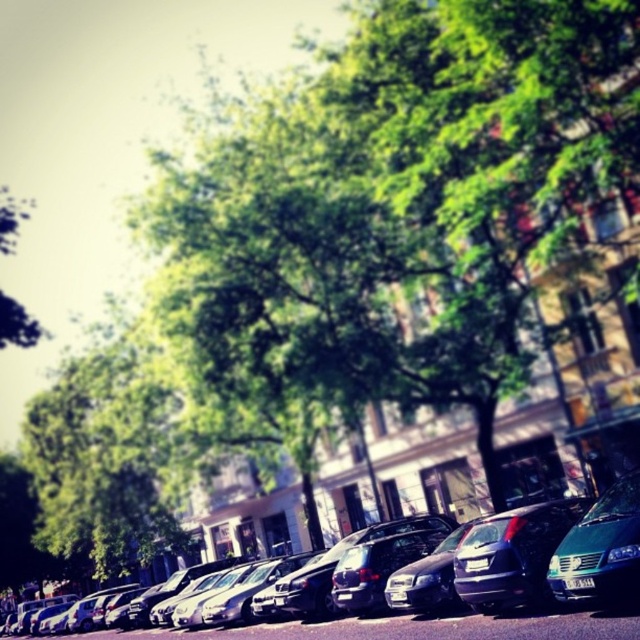
Question: Observing the image, what is the correct spatial positioning of shiny metallic sedan at center in reference to teal matte van at lower right?

Choices:
 (A) left
 (B) right

Answer: (A)

Question: Is green leafy tree at center to the right of teal matte van at lower right from the viewer's perspective?

Choices:
 (A) yes
 (B) no

Answer: (B)

Question: Which of the following is the closest to the observer?

Choices:
 (A) shiny metallic sedan at center
 (B) green leafy tree at center
 (C) teal matte van at lower right

Answer: (A)

Question: Which object is positioned closest to the green leafy tree at center?

Choices:
 (A) shiny metallic sedan at center
 (B) teal matte van at lower right

Answer: (A)

Question: Does green leafy tree at center come in front of shiny metallic sedan at center?

Choices:
 (A) no
 (B) yes

Answer: (A)

Question: Which object appears farthest from the camera in this image?

Choices:
 (A) shiny metallic sedan at center
 (B) teal matte van at lower right

Answer: (B)